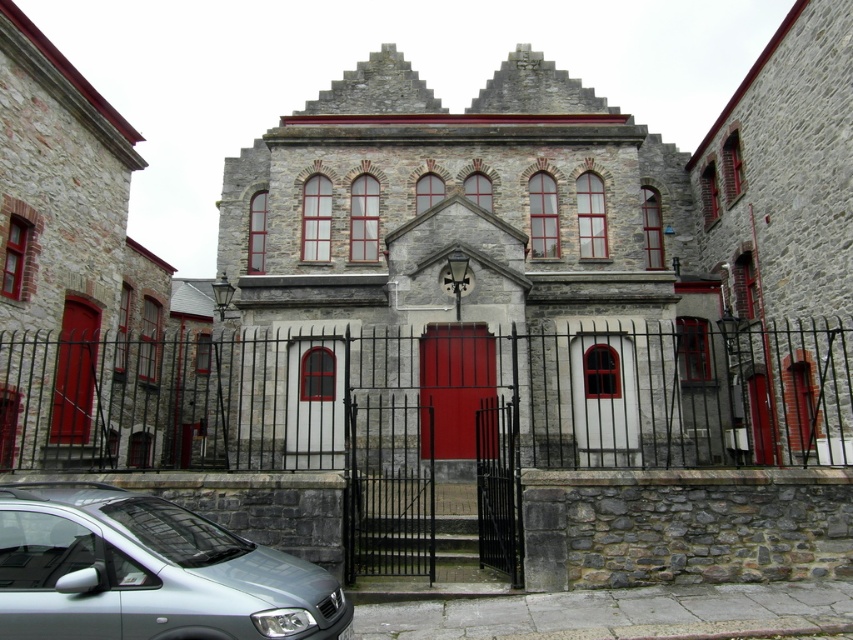
Which is above, matte wood door at center or matte glass door at center?

matte wood door at center is higher up.

Can you confirm if matte wood door at center is positioned below matte glass door at center?

Actually, matte wood door at center is above matte glass door at center.

Who is more distant from viewer, (595, 420) or (338, 387)?

The point (338, 387) is behind.

The image size is (853, 640). What are the coordinates of `matte wood door at center` in the screenshot? It's located at (604, 400).

The height and width of the screenshot is (640, 853). Find the location of `satin silver car at lower left`. satin silver car at lower left is located at coordinates (148, 572).

Who is positioned more to the right, satin silver car at lower left or smooth red door at left?

satin silver car at lower left

Locate an element on the screen. This screenshot has width=853, height=640. satin silver car at lower left is located at coordinates tap(148, 572).

Which is more to the right, matte glass door at center or smooth red door at left?

matte glass door at center

Can you confirm if matte glass door at center is thinner than smooth red door at left?

Correct, matte glass door at center's width is less than smooth red door at left's.

Is point (289, 440) less distant than point (70, 433)?

Yes, it is in front of point (70, 433).

Find the location of a particular element. The width and height of the screenshot is (853, 640). matte glass door at center is located at coordinates (315, 403).